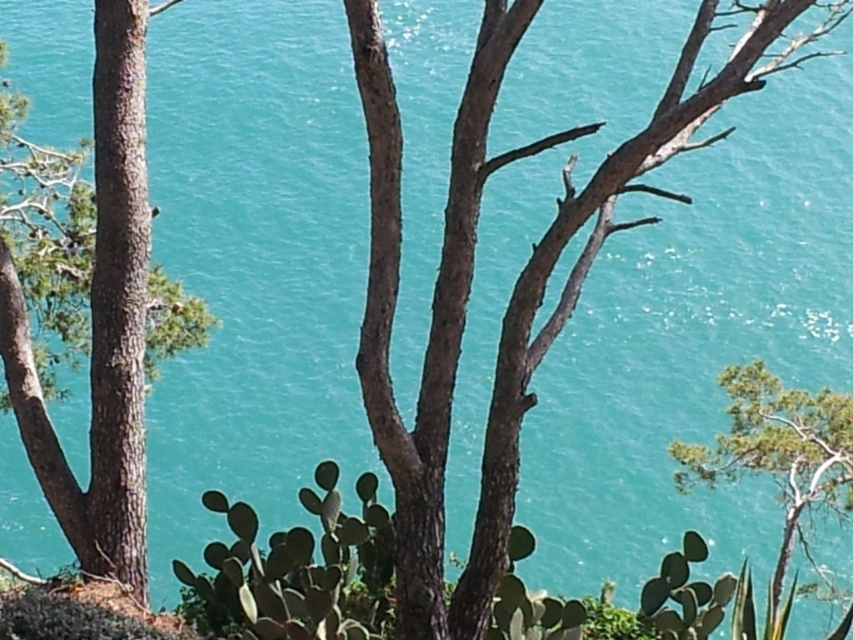
Question: Is brown rough bark tree at left positioned in front of green leafy tree at right?

Choices:
 (A) no
 (B) yes

Answer: (B)

Question: Which object is farther from the camera taking this photo?

Choices:
 (A) green leafy tree at right
 (B) brown rough bark tree at left

Answer: (A)

Question: Which point is farther from the camera taking this photo?

Choices:
 (A) (836, 401)
 (B) (78, 500)

Answer: (A)

Question: Which point appears farthest from the camera in this image?

Choices:
 (A) (135, 324)
 (B) (741, 376)

Answer: (B)

Question: Can you confirm if brown rough bark tree at left is thinner than green leafy tree at right?

Choices:
 (A) yes
 (B) no

Answer: (A)

Question: Does brown rough bark tree at left have a larger size compared to green leafy tree at right?

Choices:
 (A) no
 (B) yes

Answer: (A)